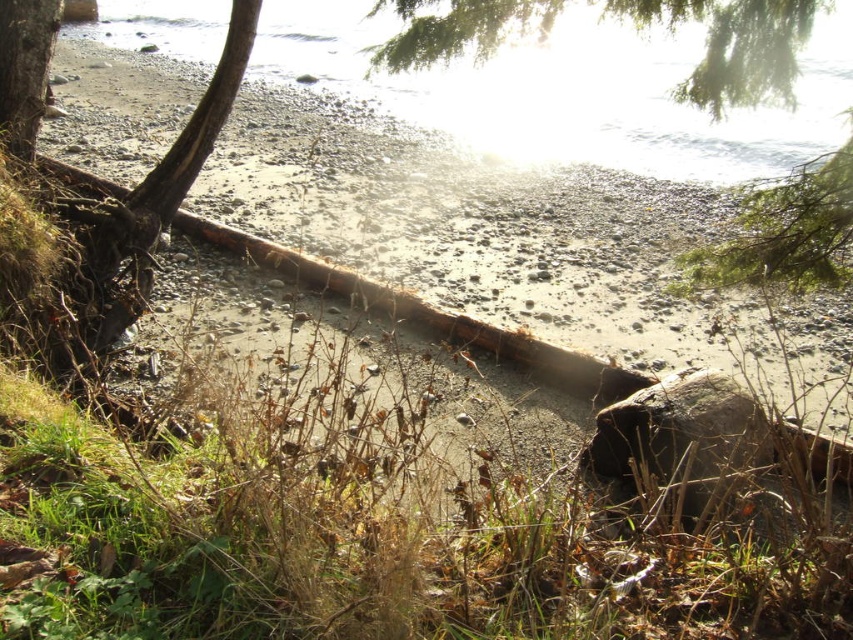
Question: Does clear water at upper center come behind smooth bark tree trunk at left?

Choices:
 (A) yes
 (B) no

Answer: (B)

Question: Can you confirm if clear water at upper center is positioned to the left of smooth bark tree trunk at left?

Choices:
 (A) yes
 (B) no

Answer: (B)

Question: Does green leafy tree at upper center have a smaller size compared to smooth bark tree trunk at left?

Choices:
 (A) no
 (B) yes

Answer: (B)

Question: Which of the following is the closest to the observer?

Choices:
 (A) (538, 116)
 (B) (15, 112)

Answer: (B)

Question: Considering the real-world distances, which object is farthest from the smooth bark tree trunk at left?

Choices:
 (A) green leafy tree at upper center
 (B) clear water at upper center

Answer: (B)

Question: Among these objects, which one is nearest to the camera?

Choices:
 (A) clear water at upper center
 (B) smooth bark tree trunk at left

Answer: (A)